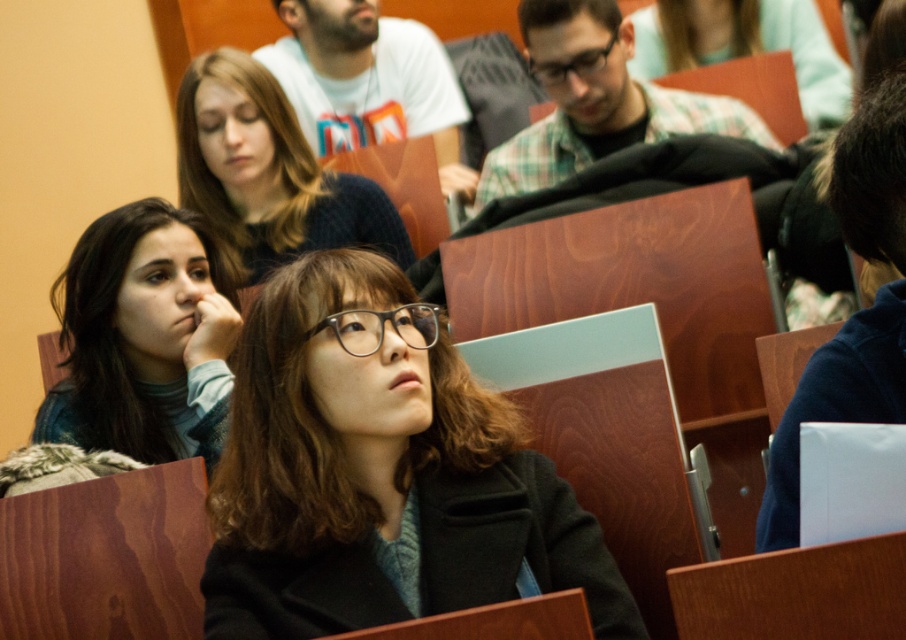
Does dark brown sweater at upper center appear on the left side of black plastic glasses at center?

Yes, dark brown sweater at upper center is to the left of black plastic glasses at center.

Who is taller, dark brown sweater at upper center or black plastic glasses at center?

dark brown sweater at upper center is taller.

Is point (230, 108) closer to camera compared to point (535, 65)?

Yes, point (230, 108) is in front of point (535, 65).

This screenshot has width=906, height=640. I want to click on dark brown sweater at upper center, so pyautogui.click(x=268, y=172).

Is light blue sweater at left shorter than dark brown sweater at upper center?

Yes, light blue sweater at left is shorter than dark brown sweater at upper center.

Does light blue sweater at left have a greater height compared to dark brown sweater at upper center?

In fact, light blue sweater at left may be shorter than dark brown sweater at upper center.

What are the coordinates of `light blue sweater at left` in the screenshot? It's located at (143, 337).

Find the location of `light blue sweater at left`. light blue sweater at left is located at coordinates (143, 337).

Can you confirm if light blue sweater at left is taller than clear plastic glasses at center?

Yes.

Can you confirm if light blue sweater at left is thinner than clear plastic glasses at center?

In fact, light blue sweater at left might be wider than clear plastic glasses at center.

Which is in front, point (68, 376) or point (350, 340)?

Point (350, 340) is more forward.

Image resolution: width=906 pixels, height=640 pixels. I want to click on light blue sweater at left, so tap(143, 337).